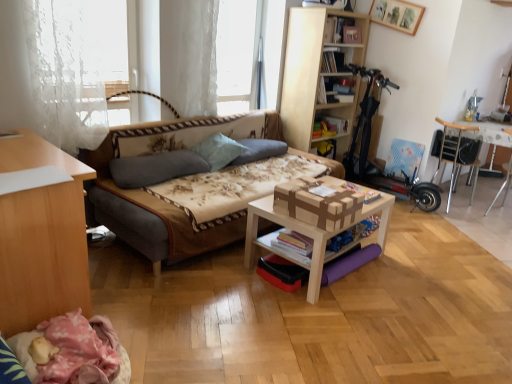
You are a GUI agent. You are given a task and a screenshot of the screen. Output one action in this format:
    pyautogui.click(x=<x>, y=<y>)
    Task: Click on the hardcover book at upper center, which ranks as the 2th book in back-to-front order
    This screenshot has width=512, height=384.
    Given the screenshot: What is the action you would take?
    pyautogui.click(x=335, y=89)

The width and height of the screenshot is (512, 384). In order to click on light wood bookshelf at upper center in this screenshot , I will do `click(322, 78)`.

Measure the distance between light wood bookshelf at upper center and camera.

A distance of 3.95 meters exists between light wood bookshelf at upper center and camera.

What do you see at coordinates (309, 226) in the screenshot? I see `light brown wooden table at center, the second table positioned from the back` at bounding box center [309, 226].

From the picture: Measure the distance between point (151, 252) and camera.

They are 2.48 meters apart.

Find the location of `light brown wood desk at lower left`. light brown wood desk at lower left is located at coordinates (42, 238).

At what (x,y) coordinates should I click in order to perform the action: click on pink fabric day bed at lower left. Please return your answer as a coordinate pair (x, y). Looking at the image, I should click on (73, 352).

You are a GUI agent. You are given a task and a screenshot of the screen. Output one action in this format:
    pyautogui.click(x=<x>, y=<y>)
    Task: Click on the hardcover book at upper center, which ranks as the 2th book in top-to-bottom order
    The width and height of the screenshot is (512, 384).
    Given the screenshot: What is the action you would take?
    pyautogui.click(x=335, y=89)

Does point (492, 141) come in front of point (314, 270)?

No, it is behind (314, 270).

Looking at this image, which of these two, metallic silver table at right, the 1th table when ordered from back to front, or light brown wooden table at center, which is the first table in front-to-back order, is bigger?

metallic silver table at right, the 1th table when ordered from back to front, is bigger.

How different are the orientations of metallic silver table at right, the 1th table when ordered from back to front, and light brown wooden table at center, the second table positioned from the back, in degrees?

The angle between the facing direction of metallic silver table at right, the 1th table when ordered from back to front, and the facing direction of light brown wooden table at center, the second table positioned from the back, is 94.6 degrees.

Does point (447, 150) come behind point (284, 257)?

That is True.

From a real-world perspective, does wooden chair at right stand above light brown wooden table at center, which is the first table in left-to-right order?

Yes.

How far apart are wooden chair at right and light brown wooden table at center, the 2th table in the right-to-left sequence?

wooden chair at right is 6.69 feet from light brown wooden table at center, the 2th table in the right-to-left sequence.

In the scene shown: How different are the orientations of wooden chair at right and light brown wooden table at center, which is the first table in left-to-right order, in degrees?

The angular difference between wooden chair at right and light brown wooden table at center, which is the first table in left-to-right order, is 81.4 degrees.

Which of these two, fluffy fabric pillow at center, which is the 3th pillow from left to right, or light brown wood desk at lower left, is bigger?

light brown wood desk at lower left is bigger.

In the image, is fluffy fabric pillow at center, which is the 3th pillow from left to right, on the left side or the right side of light brown wood desk at lower left?

fluffy fabric pillow at center, which is the 3th pillow from left to right, is positioned on light brown wood desk at lower left's right side.

Looking at their sizes, would you say fluffy fabric pillow at center, arranged as the 1th pillow when viewed from the right, is wider or thinner than light brown wood desk at lower left?

In the image, fluffy fabric pillow at center, arranged as the 1th pillow when viewed from the right, appears to be more narrow than light brown wood desk at lower left.

Is floral fabric studio couch at center located outside metallic silver table at right, the 1th table when ordered from back to front?

floral fabric studio couch at center is positioned outside metallic silver table at right, the 1th table when ordered from back to front.

Visually, is floral fabric studio couch at center positioned to the left or to the right of metallic silver table at right, which is counted as the second table, starting from the left?

From the image, it's evident that floral fabric studio couch at center is to the left of metallic silver table at right, which is counted as the second table, starting from the left.

From a real-world perspective, which table is the 1st one underneath the floral fabric studio couch at center? Please provide its 2D coordinates.

[(492, 133)]

How many degrees apart are the facing directions of floral fabric studio couch at center and metallic silver table at right, the 1th table when ordered from back to front?

There is a 87.8-degree angle between the facing directions of floral fabric studio couch at center and metallic silver table at right, the 1th table when ordered from back to front.

From the image's perspective, which is above, light blue fabric pillow at center, which appears as the second pillow when viewed from the left, or hardcover book at upper center, which ranks as the 2th book in top-to-bottom order?

hardcover book at upper center, which ranks as the 2th book in top-to-bottom order, is shown above in the image.

Choose the correct answer: Is light blue fabric pillow at center, which appears as the second pillow when viewed from the left, inside hardcover book at upper center, which ranks as the 2th book in back-to-front order, or outside it?

light blue fabric pillow at center, which appears as the second pillow when viewed from the left, is spatially situated outside hardcover book at upper center, which ranks as the 2th book in back-to-front order.

Is light blue fabric pillow at center, which appears as the second pillow when viewed from the left, facing towards hardcover book at upper center, which ranks as the 2th book in top-to-bottom order?

No, light blue fabric pillow at center, which appears as the second pillow when viewed from the left, is not oriented towards hardcover book at upper center, which ranks as the 2th book in top-to-bottom order.

In the image, is hardcover book at upper center, the 4th book when ordered from bottom to top, on the left side or the right side of wooden picture frame at upper center?

hardcover book at upper center, the 4th book when ordered from bottom to top, is positioned on wooden picture frame at upper center's left side.

Which is correct: hardcover book at upper center, positioned as the 3th book in back-to-front order, is inside wooden picture frame at upper center, or outside of it?

hardcover book at upper center, positioned as the 3th book in back-to-front order, is spatially situated outside wooden picture frame at upper center.

From a real-world perspective, is hardcover book at upper center, the 4th book when ordered from bottom to top, physically located above or below wooden picture frame at upper center?

Clearly, from a real-world perspective, hardcover book at upper center, the 4th book when ordered from bottom to top, is below wooden picture frame at upper center.

Considering the sizes of objects hardcover book at upper center, the 4th book when ordered from bottom to top, and wooden picture frame at upper center in the image provided, who is wider, hardcover book at upper center, the 4th book when ordered from bottom to top, or wooden picture frame at upper center?

hardcover book at upper center, the 4th book when ordered from bottom to top, is wider.

Is wooden picture frame at upper center turned away from matte cardboard book at upper center, the third book when ordered from top to bottom?

No, wooden picture frame at upper center's orientation is not away from matte cardboard book at upper center, the third book when ordered from top to bottom.

Can you confirm if wooden picture frame at upper center is wider than matte cardboard book at upper center, the fourth book when ordered from front to back?

No.

From a real-world perspective, is wooden picture frame at upper center below matte cardboard book at upper center, the third book when ordered from top to bottom?

No, from a real-world perspective, wooden picture frame at upper center is not beneath matte cardboard book at upper center, the third book when ordered from top to bottom.

Identify the location of table that is under the metallic silver table at right, which ranks as the 2th table in front-to-back order (from a real-world perspective). (309, 226).

Where is `chair behind the light brown wooden table at center, which is the first table in front-to-back order`? This screenshot has width=512, height=384. chair behind the light brown wooden table at center, which is the first table in front-to-back order is located at coordinates (455, 156).

From the image, which object appears to be farther from floral fabric studio couch at center, light wood bookshelf at upper center or gray fabric pillow at center, the third pillow positioned from the right?

light wood bookshelf at upper center lies further to floral fabric studio couch at center than the other object.

Based on their spatial positions, is hardcover book at center, which is the first book in bottom-to-top order, or light blue fabric pillow at center, which appears as the second pillow when viewed from the left, further from light brown wood desk at lower left?

light blue fabric pillow at center, which appears as the second pillow when viewed from the left, is further to light brown wood desk at lower left.

When comparing their distances from light wood bookshelf at upper center, does hardcover book at upper center, which ranks as the 2th book in top-to-bottom order, or pink fabric day bed at lower left seem further?

Among the two, pink fabric day bed at lower left is located further to light wood bookshelf at upper center.

Looking at the image, which one is located further to floral fabric studio couch at center, light blue fabric pillow at center, the 2th pillow in the right-to-left sequence, or white lace curtain at upper center?

white lace curtain at upper center is further to floral fabric studio couch at center.

From the image, which object appears to be farther from metallic silver table at right, the 1th table when ordered from back to front, fluffy fabric pillow at center, which is the 3th pillow from left to right, or light brown wood desk at lower left?

light brown wood desk at lower left is further to metallic silver table at right, the 1th table when ordered from back to front.

When comparing their distances from floral fabric studio couch at center, does pink fabric day bed at lower left or white lace curtain at upper center seem further?

Based on the image, pink fabric day bed at lower left appears to be further to floral fabric studio couch at center.

From the image, which object appears to be nearer to floral fabric studio couch at center, light brown wood desk at lower left or light brown wooden table at center, which is the first table in left-to-right order?

Among the two, light brown wooden table at center, which is the first table in left-to-right order, is located nearer to floral fabric studio couch at center.

When comparing their distances from light brown wooden table at center, the 2th table in the right-to-left sequence, does pink fabric day bed at lower left or hardcover book at upper center, acting as the third book starting from the bottom, seem closer?

Among the two, pink fabric day bed at lower left is located nearer to light brown wooden table at center, the 2th table in the right-to-left sequence.

Locate an element on the screen. The width and height of the screenshot is (512, 384). desk between pink fabric day bed at lower left and hardcover book at upper center, which ranks as the 2th book in top-to-bottom order, from front to back is located at coordinates (42, 238).

This screenshot has height=384, width=512. In order to click on book positioned between pink fabric day bed at lower left and gray fabric pillow at center, the 1th pillow when ordered from left to right, from near to far in this screenshot , I will do `click(294, 245)`.

Identify the location of studio couch located between pink fabric day bed at lower left and white lace curtain at upper center in the depth direction. The image size is (512, 384). (159, 198).

Image resolution: width=512 pixels, height=384 pixels. I want to click on picture frame situated between hardcover book at upper center, which ranks as the 2th book in back-to-front order, and metallic silver table at right, which ranks as the 2th table in front-to-back order, from left to right, so click(x=397, y=15).